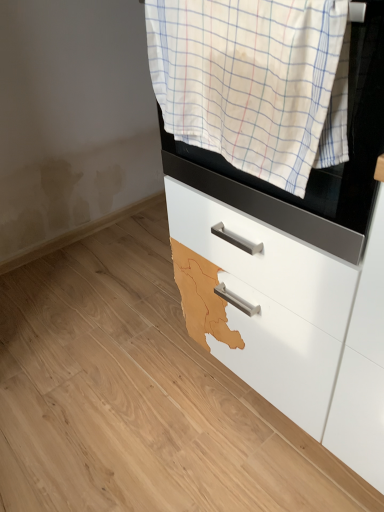
Locate an element on the screen. free spot below white checkered towel at upper center (from a real-world perspective) is located at coordinates (223, 409).